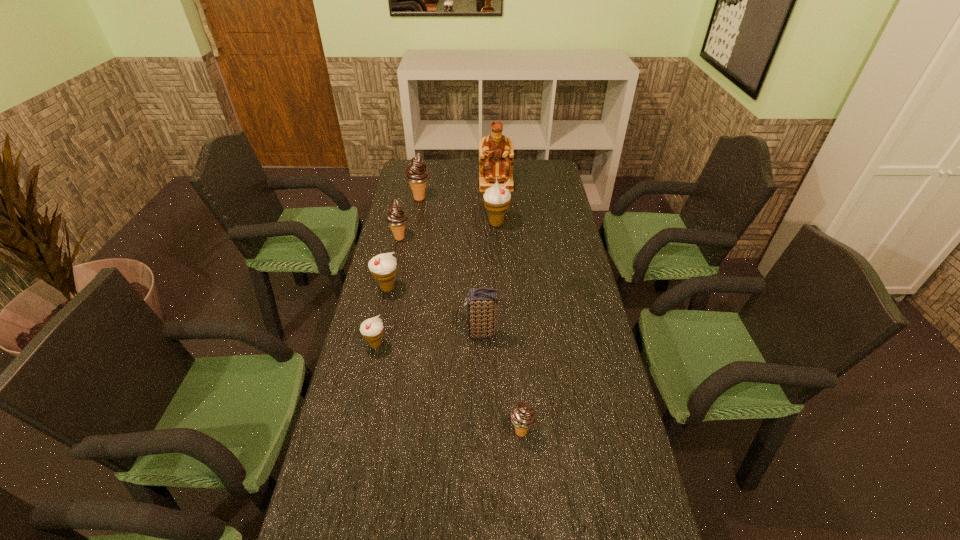
This screenshot has width=960, height=540. I want to click on free space in the image that satisfies the following two spatial constraints: 1. on the back side of the second biggest chocolate icecream; 2. on the left side of the farthest white icecream, so click(403, 224).